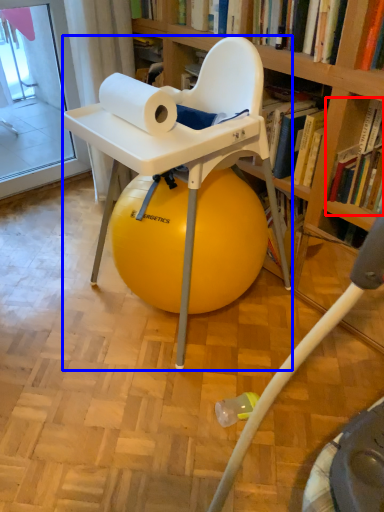
Question: Which point is closer to the camera, book (highlighted by a red box) or chair (highlighted by a blue box)?

Choices:
 (A) book
 (B) chair

Answer: (B)